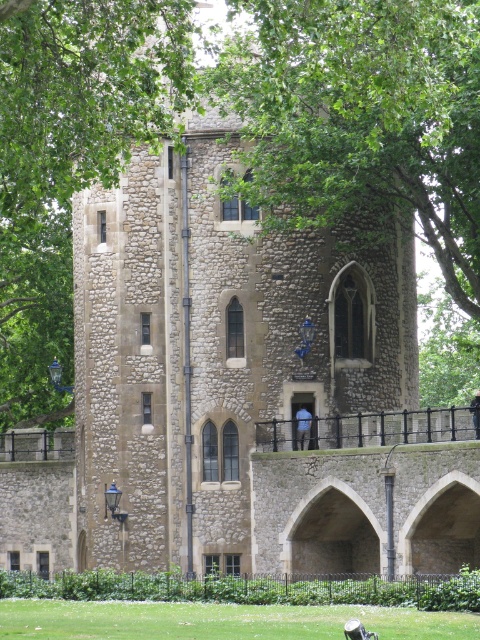
Question: Does green leafy tree at upper center appear under green grass at lower center?

Choices:
 (A) no
 (B) yes

Answer: (A)

Question: Among these points, which one is farthest from the camera?

Choices:
 (A) (68, 161)
 (B) (11, 627)

Answer: (B)

Question: Is green leafy tree at upper center in front of green grass at lower center?

Choices:
 (A) yes
 (B) no

Answer: (A)

Question: Can you confirm if green leafy tree at upper center is positioned below green grass at lower center?

Choices:
 (A) no
 (B) yes

Answer: (A)

Question: Which point is farther from the camera taking this photo?

Choices:
 (A) (108, 634)
 (B) (57, 148)

Answer: (B)